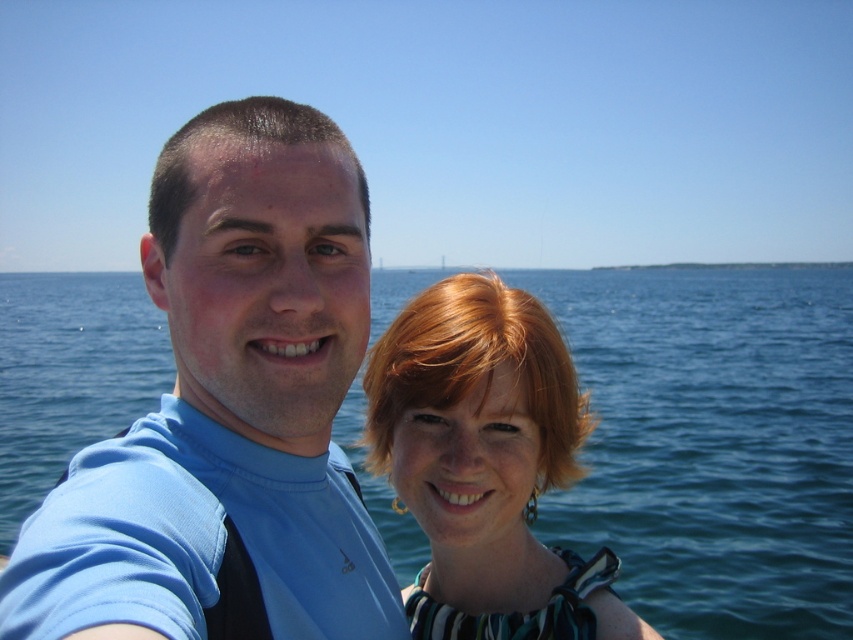
Question: Which of the following is the farthest from the observer?

Choices:
 (A) (495, 372)
 (B) (809, 538)
 (C) (326, 145)

Answer: (B)

Question: Can you confirm if blue fabric shirt at center is positioned above shiny green dress at center?

Choices:
 (A) no
 (B) yes

Answer: (B)

Question: Which point is closer to the camera?

Choices:
 (A) (461, 499)
 (B) (695, 541)

Answer: (A)

Question: Which point appears farthest from the camera in this image?

Choices:
 (A) (82, 387)
 (B) (54, 529)

Answer: (A)

Question: Is blue water at center to the left of blue fabric shirt at center from the viewer's perspective?

Choices:
 (A) no
 (B) yes

Answer: (A)

Question: Can you confirm if blue fabric shirt at center is positioned below shiny green dress at center?

Choices:
 (A) no
 (B) yes

Answer: (A)